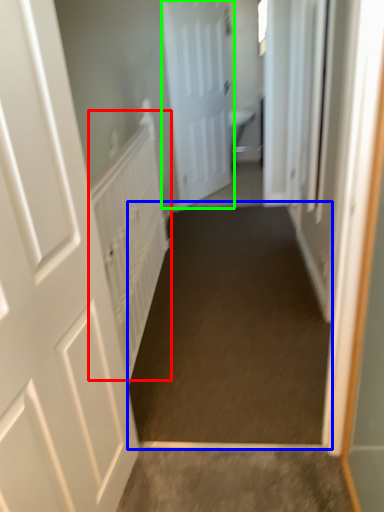
Question: Based on their relative distances, which object is farther from radiator (highlighted by a red box)? Choose from path (highlighted by a blue box) and door (highlighted by a green box).

Choices:
 (A) path
 (B) door

Answer: (B)